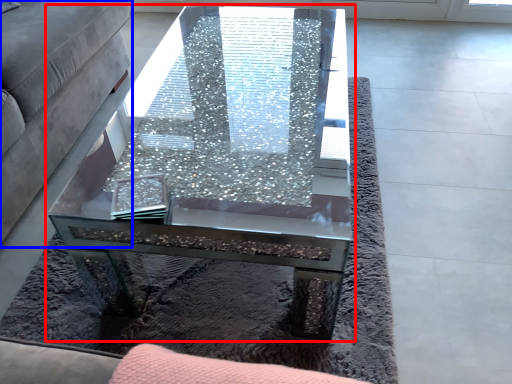
Question: Which object appears farthest to the camera in this image, coffee table (highlighted by a red box) or studio couch (highlighted by a blue box)?

Choices:
 (A) coffee table
 (B) studio couch

Answer: (A)